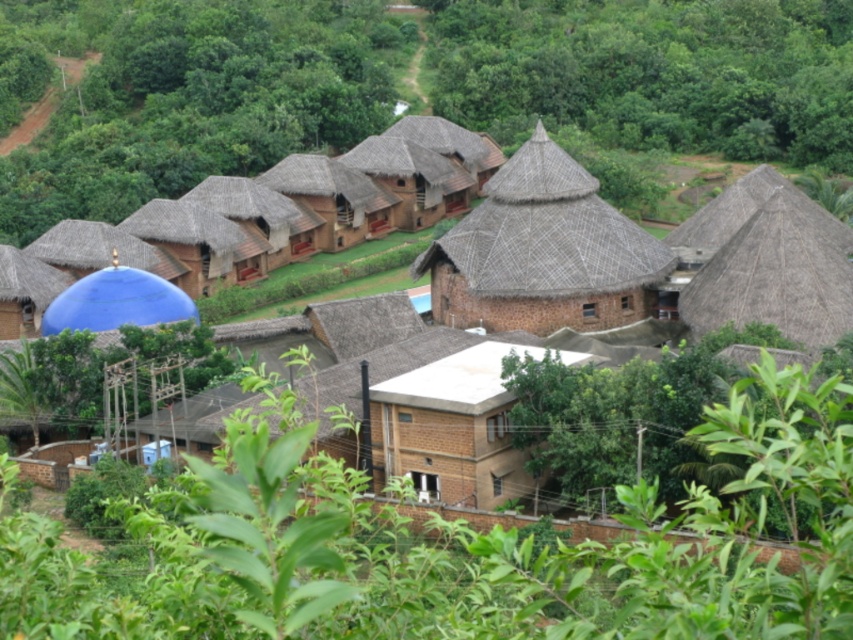
Does green leafy vegetation at center lie behind thatched brown hut at upper right?

No, it is not.

This screenshot has width=853, height=640. What do you see at coordinates (462, 547) in the screenshot? I see `green leafy vegetation at center` at bounding box center [462, 547].

Does point (28, 611) lie behind point (730, 308)?

No, it is not.

The image size is (853, 640). I want to click on green leafy vegetation at center, so click(x=462, y=547).

Is the position of green leafy vegetation at center more distant than that of brown thatched-roof houses at center?

No, green leafy vegetation at center is in front of brown thatched-roof houses at center.

Is green leafy vegetation at center closer to the viewer compared to brown thatched-roof houses at center?

Yes, it is in front of brown thatched-roof houses at center.

Identify the location of green leafy vegetation at center. This screenshot has width=853, height=640. (462, 547).

Is brown thatched-roof houses at center shorter than thatched brown hut at upper right?

No, brown thatched-roof houses at center is not shorter than thatched brown hut at upper right.

Is brown thatched-roof houses at center above thatched brown hut at upper right?

No.

Measure the distance between point (772, 189) and camera.

Point (772, 189) is 115.81 meters away from camera.

This screenshot has height=640, width=853. In order to click on brown thatched-roof houses at center in this screenshot , I will do `click(637, 259)`.